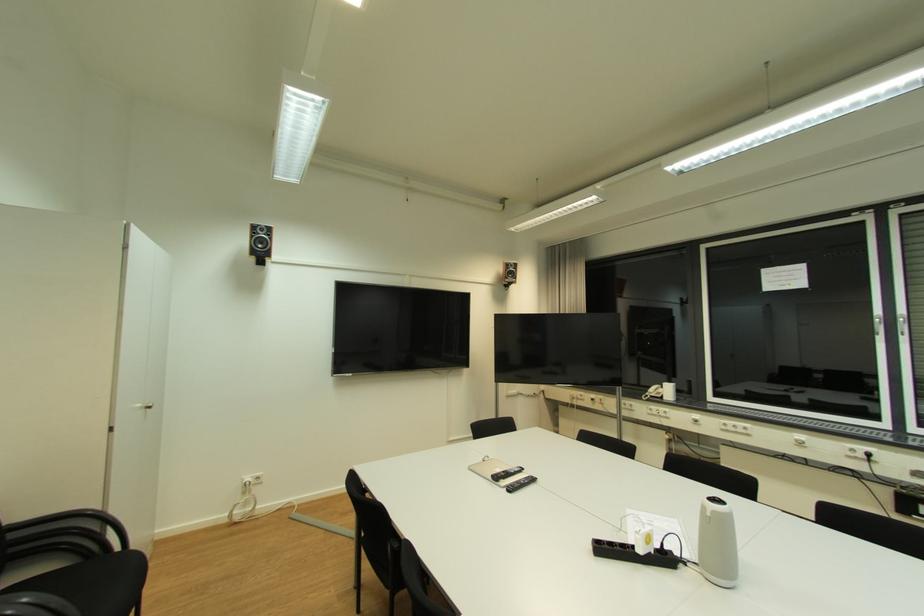
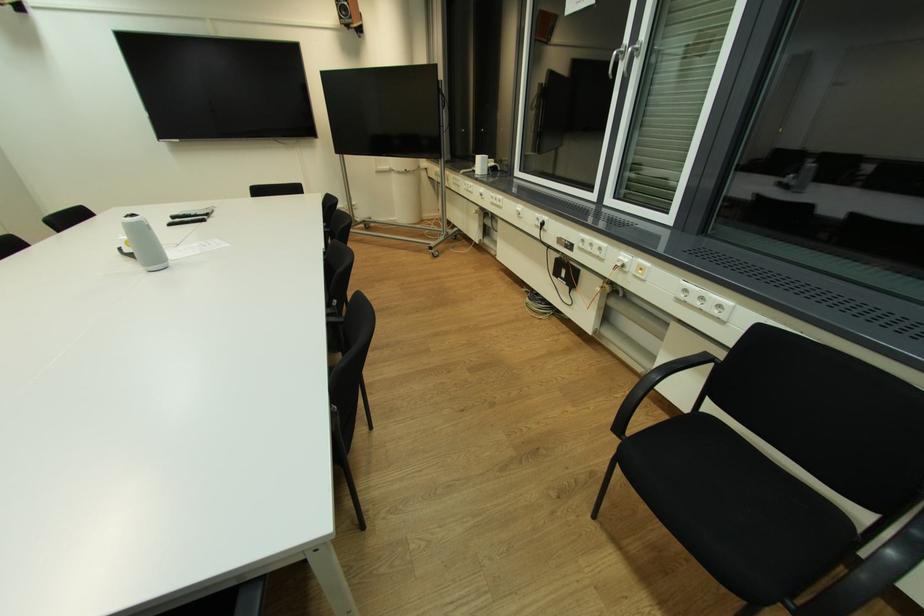
The point at (516,277) is marked in the first image. Where is the corresponding point in the second image?

(349, 15)